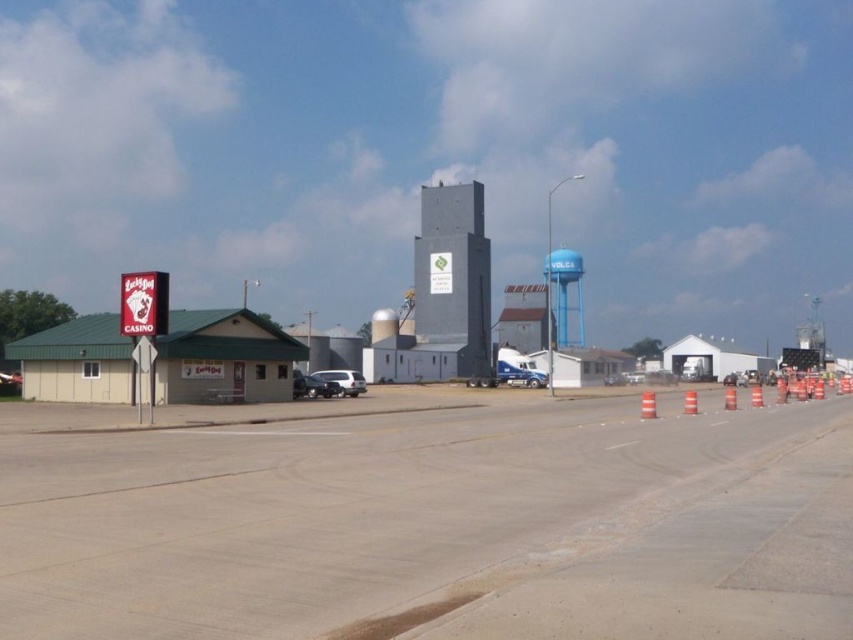
Can you confirm if orange reflective plastic traffic cone at center-right is taller than orange reflective cone at center-right?

Indeed, orange reflective plastic traffic cone at center-right has a greater height compared to orange reflective cone at center-right.

Between orange reflective plastic traffic cone at center-right and orange reflective cone at center-right, which one appears on the left side from the viewer's perspective?

Positioned to the left is orange reflective plastic traffic cone at center-right.

Which is behind, point (641, 416) or point (753, 401)?

The point (753, 401) is behind.

Where is `orange reflective plastic traffic cone at center-right`? Image resolution: width=853 pixels, height=640 pixels. orange reflective plastic traffic cone at center-right is located at coordinates (648, 404).

Between blue painted water tower at center right and satin silver suv at center, which one appears on the right side from the viewer's perspective?

blue painted water tower at center right is more to the right.

Does point (579, 282) lie in front of point (352, 385)?

No, it is behind (352, 385).

Where is `blue painted water tower at center right`? blue painted water tower at center right is located at coordinates (566, 292).

Describe the element at coordinates (566, 292) in the screenshot. I see `blue painted water tower at center right` at that location.

Which is above, blue painted water tower at center right or metallic silver sedan at center?

blue painted water tower at center right is above.

What do you see at coordinates (566, 292) in the screenshot?
I see `blue painted water tower at center right` at bounding box center [566, 292].

Where is `blue painted water tower at center right`? The height and width of the screenshot is (640, 853). blue painted water tower at center right is located at coordinates (566, 292).